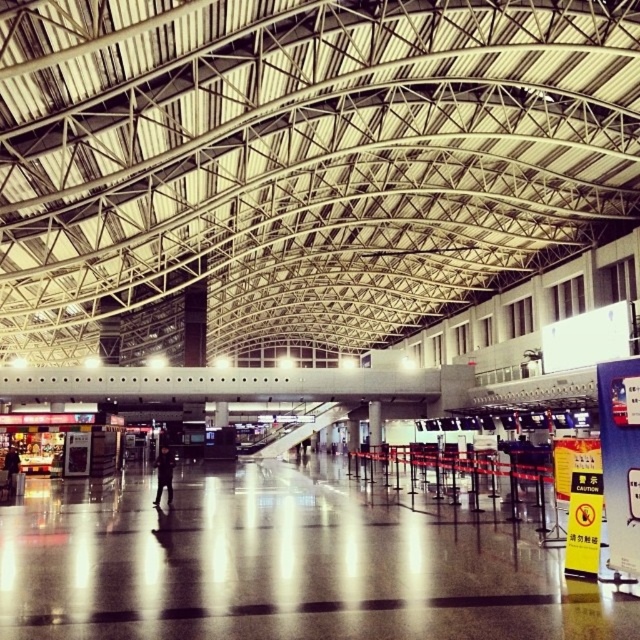
You are an airport staff member who needs to direct passengers to the nearest check in counter. You see a black matte person at center and a dark gray suit at left. Which object is closer to you?

The black matte person at center is bigger than dark gray suit at left, so it is closer to you.